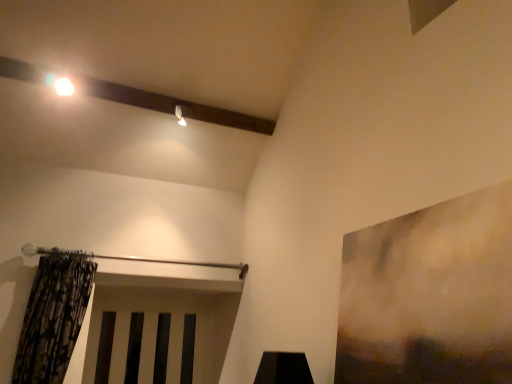
What do you see at coordinates (53, 317) in the screenshot?
I see `patterned fabric curtain at left` at bounding box center [53, 317].

Where is `patterned fabric curtain at left`? The image size is (512, 384). patterned fabric curtain at left is located at coordinates (53, 317).

Where is `patterned fabric curtain at left`? The image size is (512, 384). patterned fabric curtain at left is located at coordinates (53, 317).